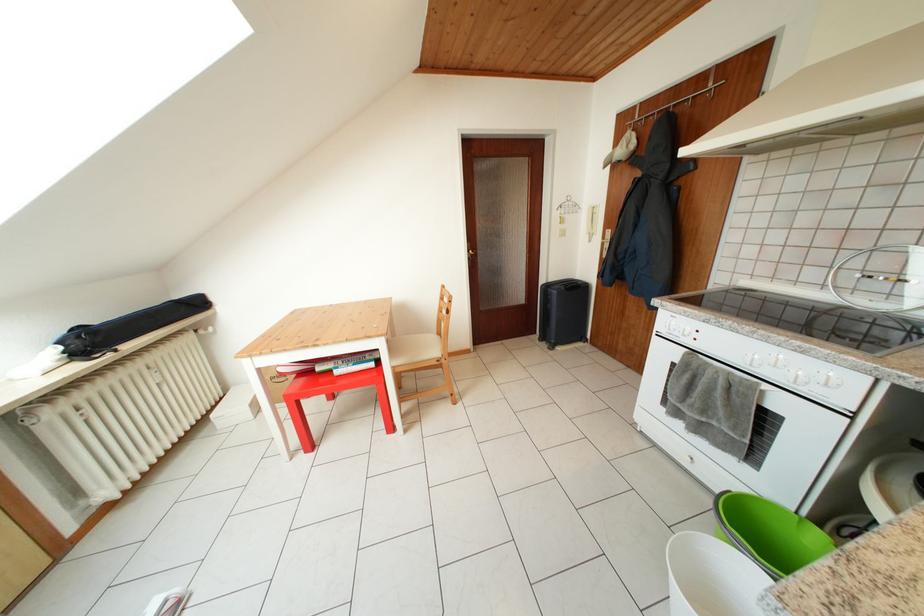
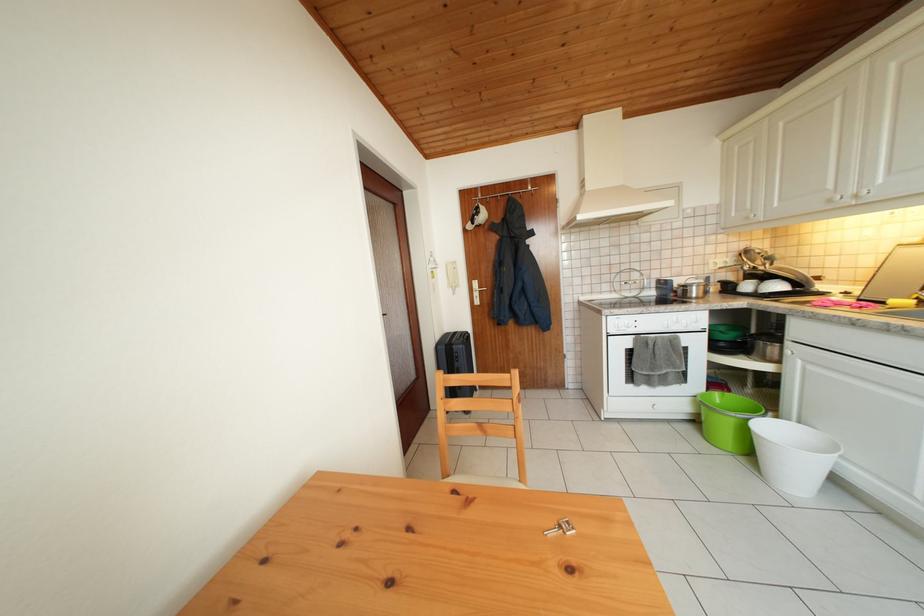
Locate, in the second image, the point that corresponds to the point at 657,108 in the first image.

(494, 193)